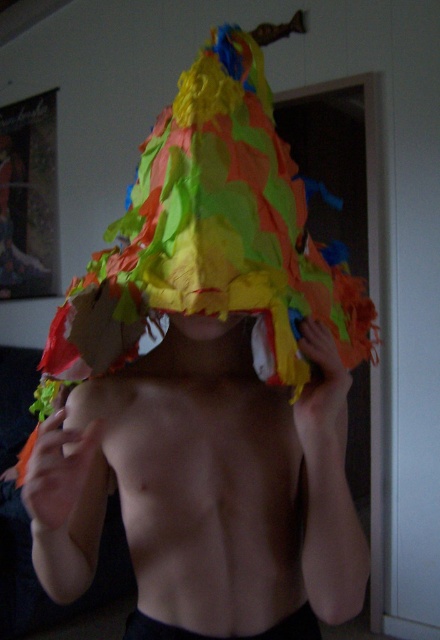
You are a fashion designer working on a new collection. You have two items in front of you, the black fabric at center and the matte paper mask at center. You need to place them on a mannequin for a runway show. The mannequin can only accommodate items within 12 inches of each other. Can both items be placed on the mannequin without exceeding the distance limit?

The black fabric at center and matte paper mask at center are 13.91 inches apart, which exceeds the 12 inch limit. Therefore, they cannot both be placed on the mannequin without exceeding the distance limit.

You are an interior designer observing the scene. You need to place a small decorative item between the black fabric at center and the matte paper mask at center. Based on their positions, which object should the item be closer to?

The black fabric at center is to the right of the matte paper mask at center, so the decorative item should be placed closer to the matte paper mask at center to maintain symmetry.

Based on the scene description, which object is positioned lower between the black fabric at center and the matte paper mask at center?

The black fabric at center is positioned lower than the matte paper mask at center according to the description.